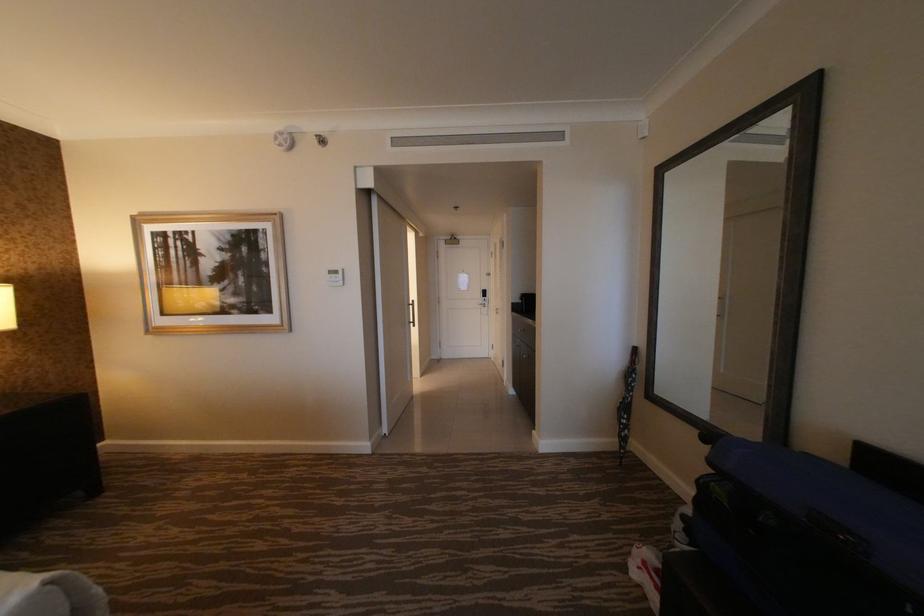
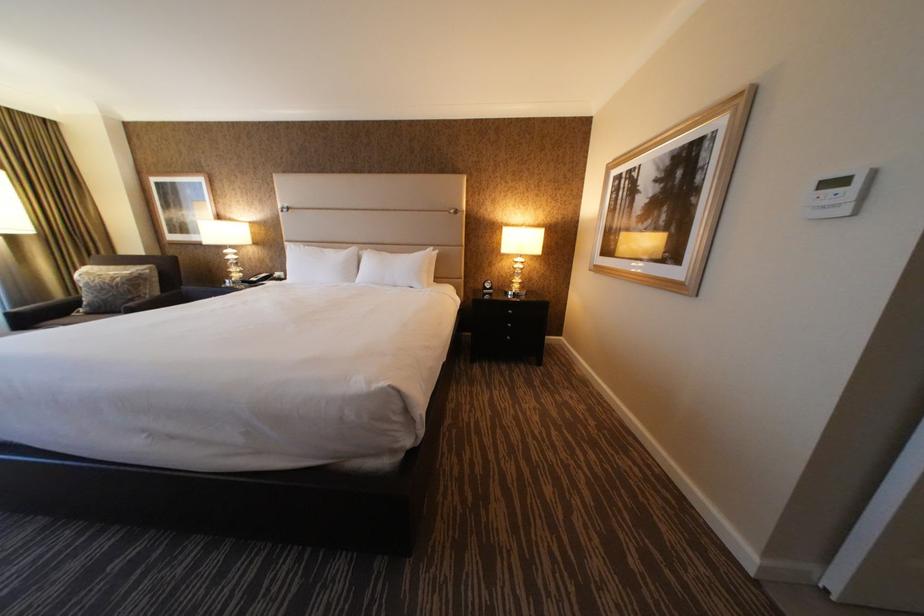
Based on the continuous images, in which direction is the camera rotating?

The camera rotated toward left-down.